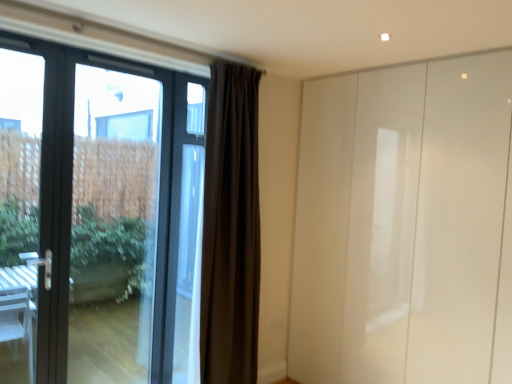
Measure the distance between point (124, 67) and camera.

They are 8.44 feet apart.

The height and width of the screenshot is (384, 512). Describe the element at coordinates (113, 225) in the screenshot. I see `transparent glass door at left` at that location.

The width and height of the screenshot is (512, 384). What do you see at coordinates (404, 225) in the screenshot?
I see `glossy white wardrobe at right` at bounding box center [404, 225].

At what (x,y) coordinates should I click in order to perform the action: click on matte black door at left. Please return your answer as a coordinate pair (x, y). The image size is (512, 384). Looking at the image, I should click on (97, 214).

From the image's perspective, which object appears higher, glossy white wardrobe at right or transparent glass door at left?

From the image's view, transparent glass door at left is above.

Which is more to the right, glossy white wardrobe at right or transparent glass door at left?

glossy white wardrobe at right is more to the right.

Considering the sizes of objects glossy white wardrobe at right and transparent glass door at left in the image provided, who is smaller, glossy white wardrobe at right or transparent glass door at left?

With smaller size is transparent glass door at left.

From the image's perspective, is transparent glass door at left above or below glossy white wardrobe at right?

Clearly, from the image's perspective, transparent glass door at left is above glossy white wardrobe at right.

This screenshot has width=512, height=384. Find the location of `screen door that is on the right side of transparent glass door at left`. screen door that is on the right side of transparent glass door at left is located at coordinates (404, 225).

Could you tell me if transparent glass door at left is facing glossy white wardrobe at right?

No, transparent glass door at left is not oriented towards glossy white wardrobe at right.

Is transparent glass door at left in contact with matte black door at left?

Indeed, transparent glass door at left and matte black door at left are beside each other and touching.

Can you confirm if transparent glass door at left is positioned to the right of matte black door at left?

Correct, you'll find transparent glass door at left to the right of matte black door at left.

Looking at this image, is transparent glass door at left oriented towards matte black door at left?

Yes, transparent glass door at left faces towards matte black door at left.

Is matte black door at left completely or partially inside transparent glass door at left?

No, matte black door at left is not a part of transparent glass door at left.

Based on their positions, is glossy white wardrobe at right located to the left or right of dark matte curtain at center?

From the image, it's evident that glossy white wardrobe at right is to the right of dark matte curtain at center.

In the scene shown: Would you consider glossy white wardrobe at right to be distant from dark matte curtain at center?

That's not correct — glossy white wardrobe at right is a little close to dark matte curtain at center.

In the scene shown: Can you confirm if glossy white wardrobe at right is bigger than dark matte curtain at center?

Yes, glossy white wardrobe at right is bigger than dark matte curtain at center.

Considering the positions of objects matte black door at left and transparent glass door at left in the image provided, who is more to the left, matte black door at left or transparent glass door at left?

From the viewer's perspective, matte black door at left appears more on the left side.

Considering the positions of points (120, 67) and (99, 295), is point (120, 67) farther from camera compared to point (99, 295)?

That is False.

Who is bigger, matte black door at left or transparent glass door at left?

matte black door at left.

From the image's perspective, who appears lower, glossy white wardrobe at right or matte black door at left?

glossy white wardrobe at right.

You are a GUI agent. You are given a task and a screenshot of the screen. Output one action in this format:
    pyautogui.click(x=<x>, y=<y>)
    Task: Click on the door on the left of glossy white wardrobe at right
    This screenshot has width=512, height=384.
    Given the screenshot: What is the action you would take?
    (x=97, y=214)

Considering the relative sizes of glossy white wardrobe at right and matte black door at left in the image provided, is glossy white wardrobe at right smaller than matte black door at left?

No, glossy white wardrobe at right is not smaller than matte black door at left.

Would you say glossy white wardrobe at right is a long distance from matte black door at left?

glossy white wardrobe at right is far away from matte black door at left.

Locate an element on the screen. The height and width of the screenshot is (384, 512). screen door below the dark matte curtain at center (from the image's perspective) is located at coordinates (404, 225).

Considering the sizes of objects dark matte curtain at center and glossy white wardrobe at right in the image provided, who is thinner, dark matte curtain at center or glossy white wardrobe at right?

Thinner between the two is dark matte curtain at center.

Considering the sizes of objects dark matte curtain at center and glossy white wardrobe at right in the image provided, who is bigger, dark matte curtain at center or glossy white wardrobe at right?

glossy white wardrobe at right is bigger.

Can you tell me how much dark matte curtain at center and glossy white wardrobe at right differ in facing direction?

The facing directions of dark matte curtain at center and glossy white wardrobe at right are 91.8 degrees apart.

Identify the location of glass door on the left of the glossy white wardrobe at right. (113, 225).

Find the location of `screen door below the transparent glass door at left (from a real-world perspective)`. screen door below the transparent glass door at left (from a real-world perspective) is located at coordinates (404, 225).

When comparing their distances from transparent glass door at left, does dark matte curtain at center or glossy white wardrobe at right seem further?

The object further to transparent glass door at left is glossy white wardrobe at right.

Estimate the real-world distances between objects in this image. Which object is further from transparent glass door at left, matte black door at left or glossy white wardrobe at right?

glossy white wardrobe at right.

Considering their positions, is dark matte curtain at center positioned closer to matte black door at left than glossy white wardrobe at right?

dark matte curtain at center is closer to matte black door at left.

Looking at the image, which one is located closer to transparent glass door at left, dark matte curtain at center or matte black door at left?

matte black door at left is closer to transparent glass door at left.

Looking at the image, which one is located closer to dark matte curtain at center, matte black door at left or glossy white wardrobe at right?

glossy white wardrobe at right.

From the image, which object appears to be farther from dark matte curtain at center, glossy white wardrobe at right or matte black door at left?

matte black door at left lies further to dark matte curtain at center than the other object.

Looking at the image, which one is located further to transparent glass door at left, matte black door at left or dark matte curtain at center?

Based on the image, dark matte curtain at center appears to be further to transparent glass door at left.

Based on their spatial positions, is transparent glass door at left or matte black door at left further from glossy white wardrobe at right?

Among the two, matte black door at left is located further to glossy white wardrobe at right.

Locate an element on the screen. curtain between transparent glass door at left and glossy white wardrobe at right is located at coordinates (230, 228).

Locate an element on the screen. glass door situated between matte black door at left and glossy white wardrobe at right from left to right is located at coordinates (113, 225).

Find the location of a particular element. glass door between matte black door at left and dark matte curtain at center is located at coordinates (113, 225).

Locate an element on the screen. The image size is (512, 384). curtain between matte black door at left and glossy white wardrobe at right in the horizontal direction is located at coordinates (230, 228).